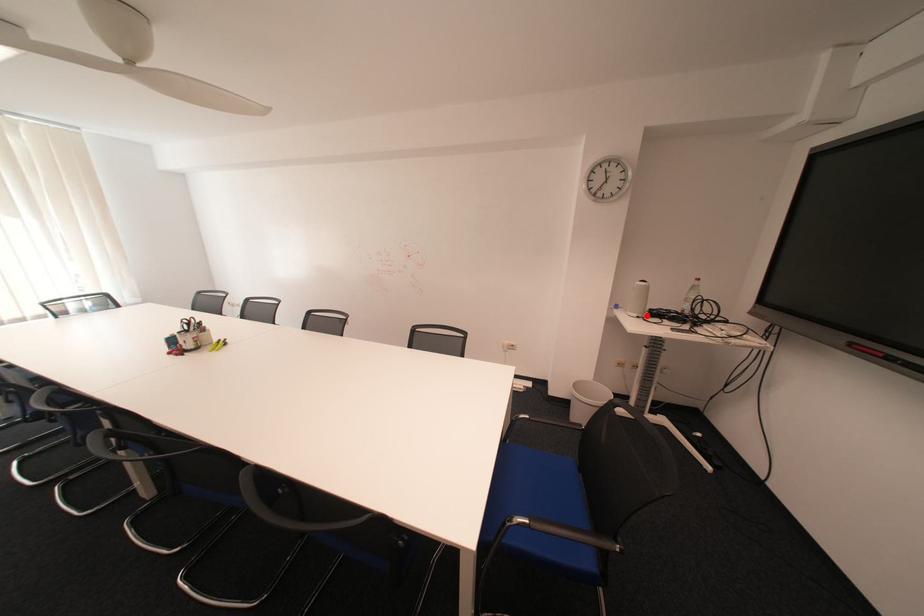
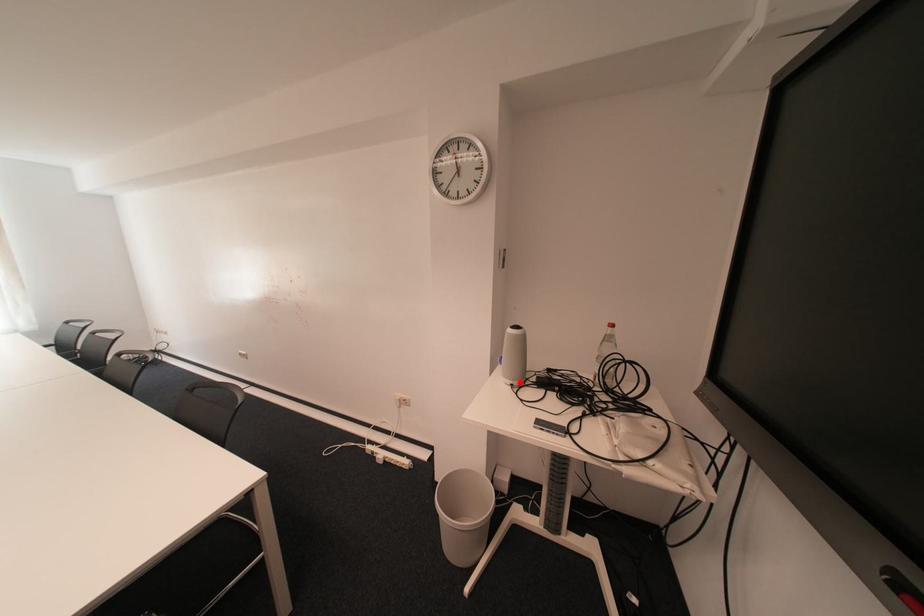
I am providing you with two images of the same scene from different viewpoints. A red point is marked on the first image and another point is marked on the second image. Are the points marked in image1 and image2 representing the same 3D position?

Yes